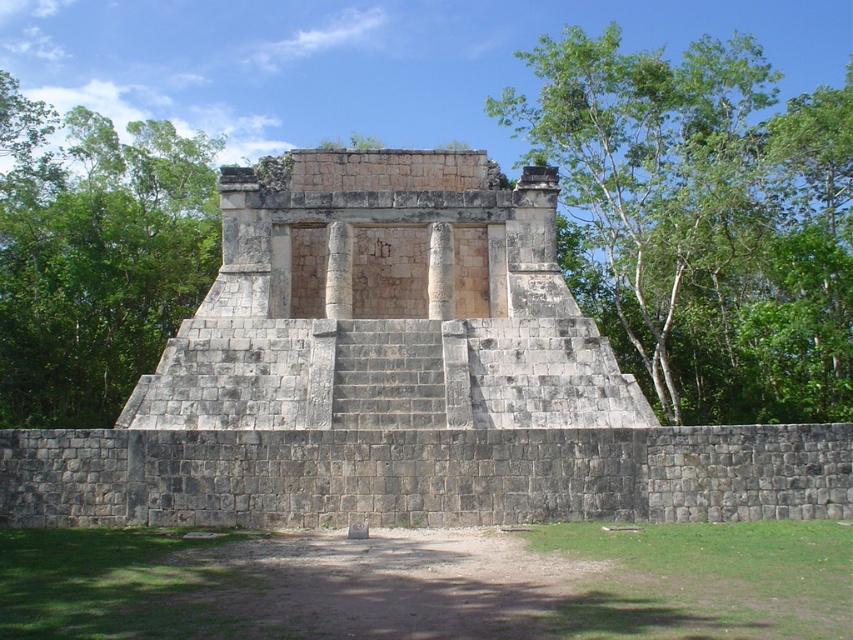
Who is positioned more to the left, stone/rough pyramid at center or green leafy tree at upper right?

Positioned to the left is stone/rough pyramid at center.

Between stone/rough pyramid at center and green leafy tree at upper right, which one is positioned higher?

green leafy tree at upper right is higher up.

Between point (250, 396) and point (759, 188), which one is positioned behind?

Positioned behind is point (759, 188).

This screenshot has width=853, height=640. I want to click on stone/rough pyramid at center, so click(x=387, y=307).

Which is more to the left, stone/rough pyramid at center or green leafy tree at upper left?

Positioned to the left is green leafy tree at upper left.

Does stone/rough pyramid at center come in front of green leafy tree at upper left?

Yes, stone/rough pyramid at center is in front of green leafy tree at upper left.

Does point (401, 424) lie behind point (90, 376)?

No, (401, 424) is closer to viewer.

You are a GUI agent. You are given a task and a screenshot of the screen. Output one action in this format:
    pyautogui.click(x=<x>, y=<y>)
    Task: Click on the stone/rough pyramid at center
    
    Given the screenshot: What is the action you would take?
    pyautogui.click(x=387, y=307)

Is green leafy tree at upper right positioned at the back of green leafy tree at upper left?

No, it is not.

In the scene shown: Is green leafy tree at upper right to the right of green leafy tree at upper left from the viewer's perspective?

Indeed, green leafy tree at upper right is positioned on the right side of green leafy tree at upper left.

Is point (598, 292) farther from camera compared to point (44, 326)?

Yes, point (598, 292) is farther from viewer.

At what (x,y) coordinates should I click in order to perform the action: click on green leafy tree at upper right. Please return your answer as a coordinate pair (x, y). The height and width of the screenshot is (640, 853). Looking at the image, I should click on (701, 220).